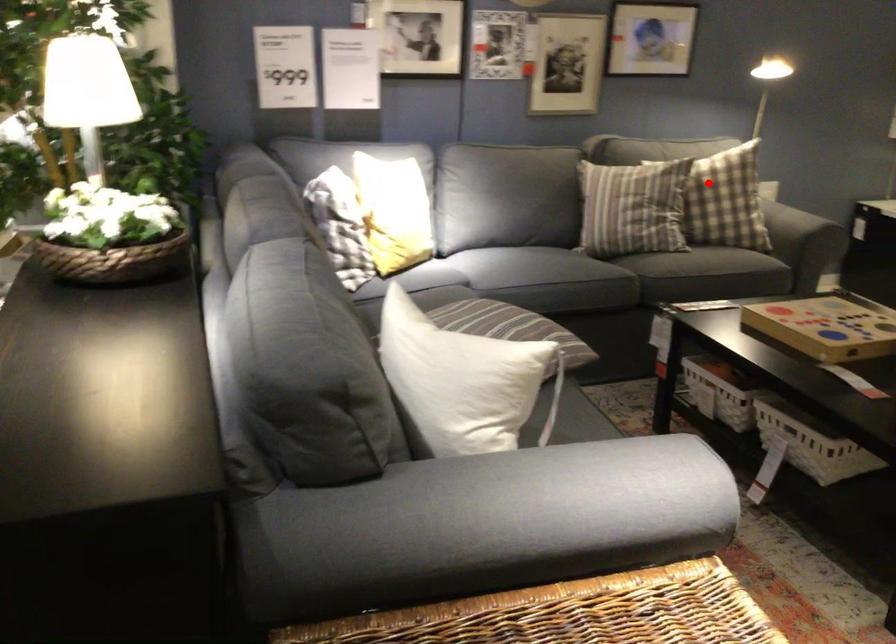
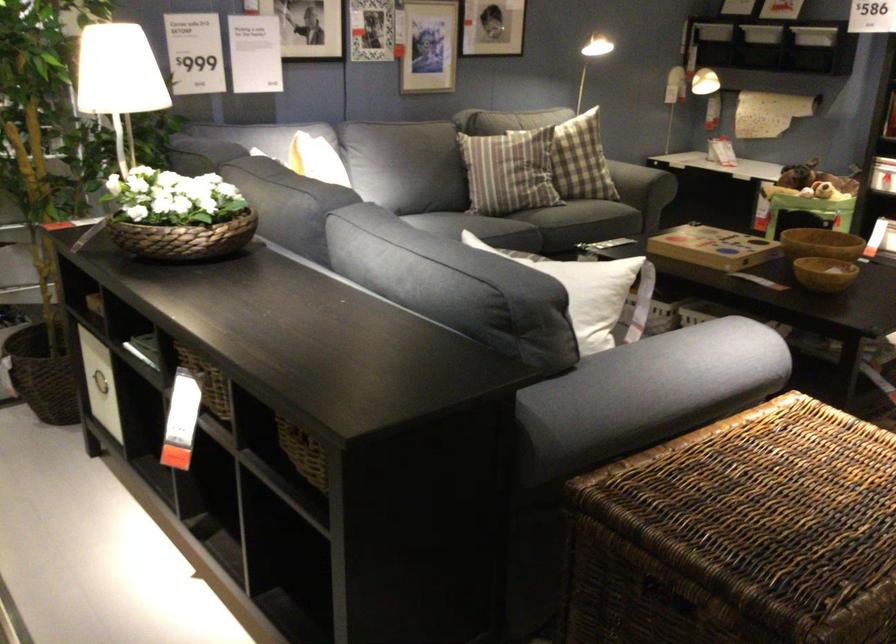
Find the pixel in the second image that matches the highlighted location in the first image.

(581, 160)